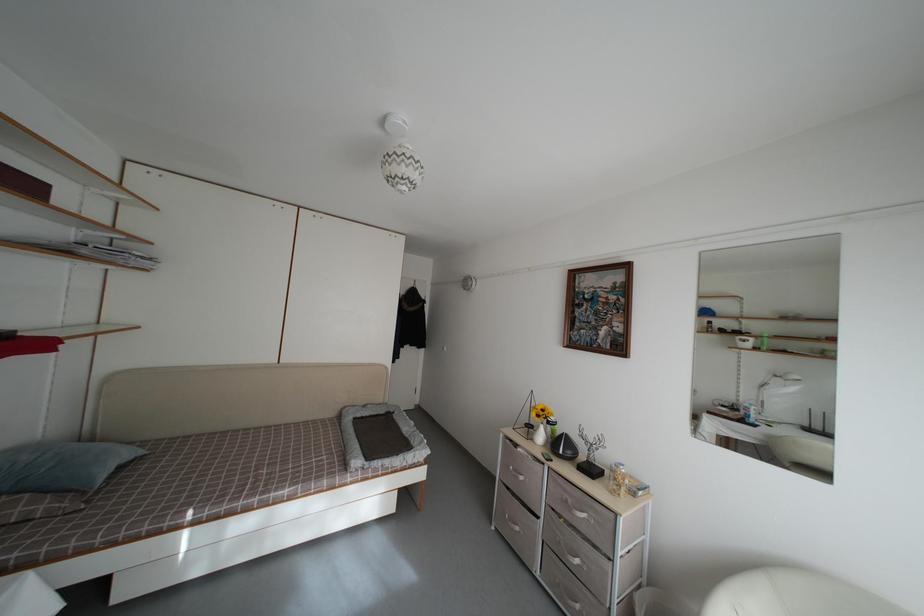
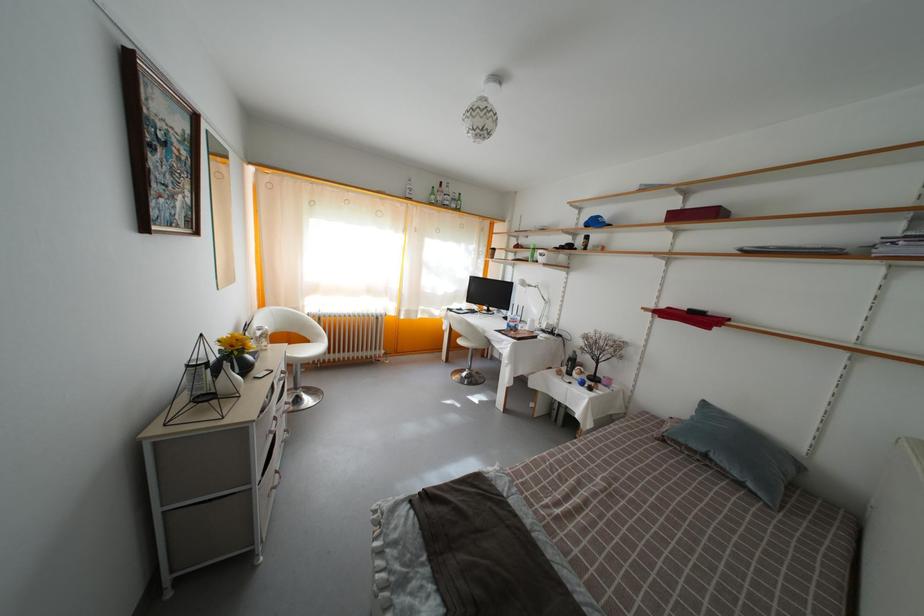
In the second image, find the point that corresponds to point 139,464 in the first image.

(743, 482)